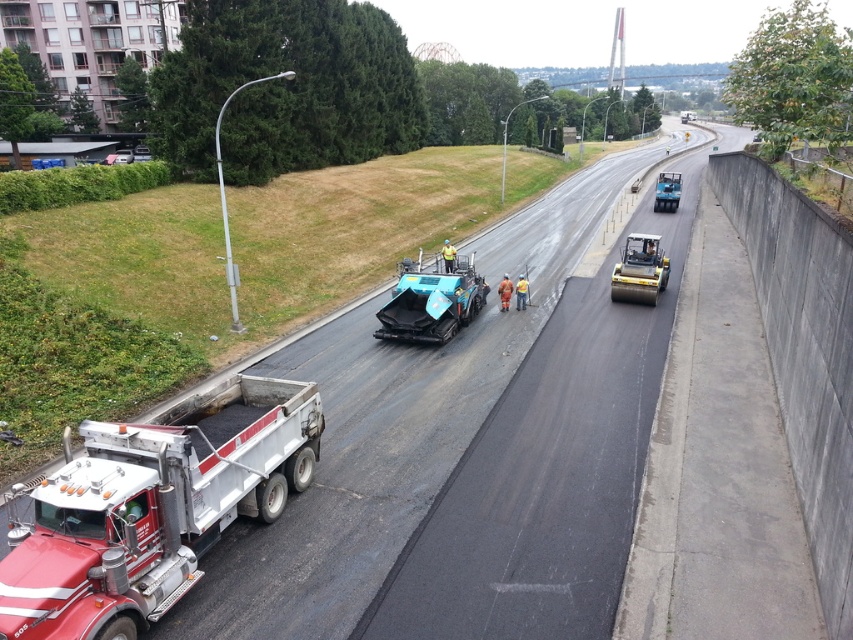
Question: Does black asphalt road at center lie in front of teal rubber asphalt spreader at center?

Choices:
 (A) yes
 (B) no

Answer: (A)

Question: Which point is closer to the camera?

Choices:
 (A) teal rubber asphalt spreader at center
 (B) red metallic dump truck at lower left

Answer: (B)

Question: Which point appears farthest from the camera in this image?

Choices:
 (A) (421, 280)
 (B) (173, 428)

Answer: (A)

Question: In this image, where is red metallic dump truck at lower left located relative to teal rubber asphalt spreader at center?

Choices:
 (A) right
 (B) left

Answer: (B)

Question: Is black asphalt road at center above teal rubber asphalt spreader at center?

Choices:
 (A) no
 (B) yes

Answer: (B)

Question: Which point appears closest to the camera in this image?

Choices:
 (A) (138, 588)
 (B) (512, 362)

Answer: (A)